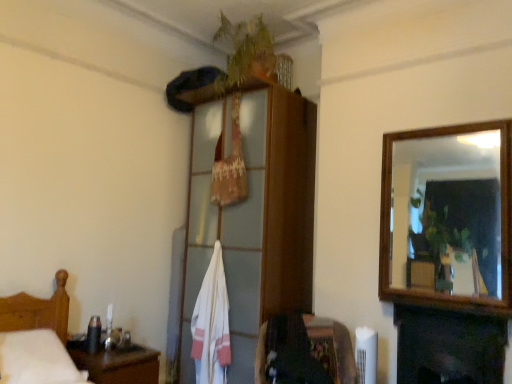
Question: From the image's perspective, is dark wood fireplace at lower right positioned above or below white cotton bath towel at center?

Choices:
 (A) below
 (B) above

Answer: (A)

Question: Is dark wood fireplace at lower right bigger or smaller than white cotton bath towel at center?

Choices:
 (A) small
 (B) big

Answer: (A)

Question: Which is nearer to the wooden cabinet at upper center?

Choices:
 (A) green leafy plant at upper center
 (B) white cotton bath towel at center
 (C) velvet dark brown chair at lower center
 (D) dark wood fireplace at lower right
 (E) wooden headboard at left

Answer: (B)

Question: Considering the real-world distances, which object is farthest from the white cotton bath towel at center?

Choices:
 (A) green leafy plant at upper center
 (B) wooden cabinet at upper center
 (C) wooden table at lower left
 (D) wooden headboard at left
 (E) velvet dark brown chair at lower center

Answer: (A)